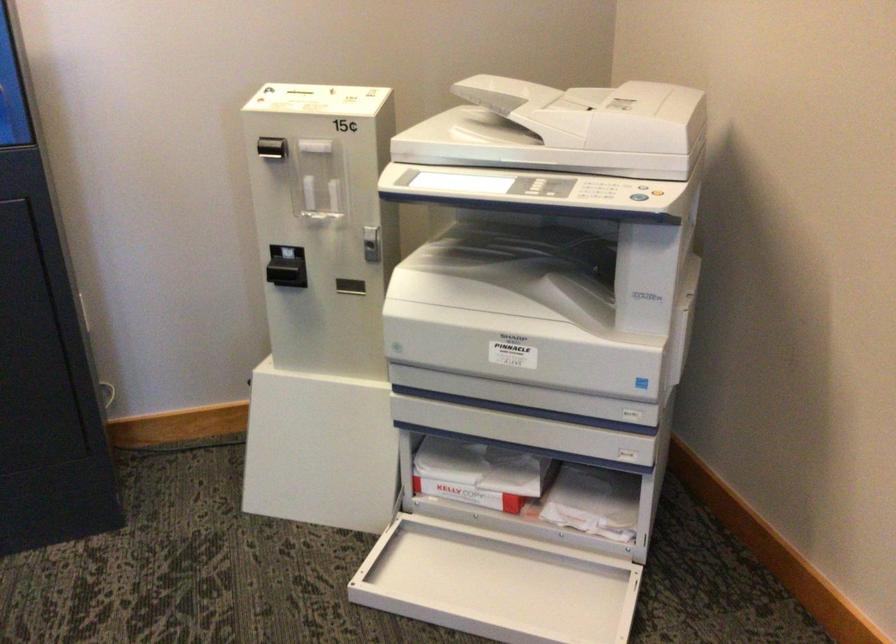
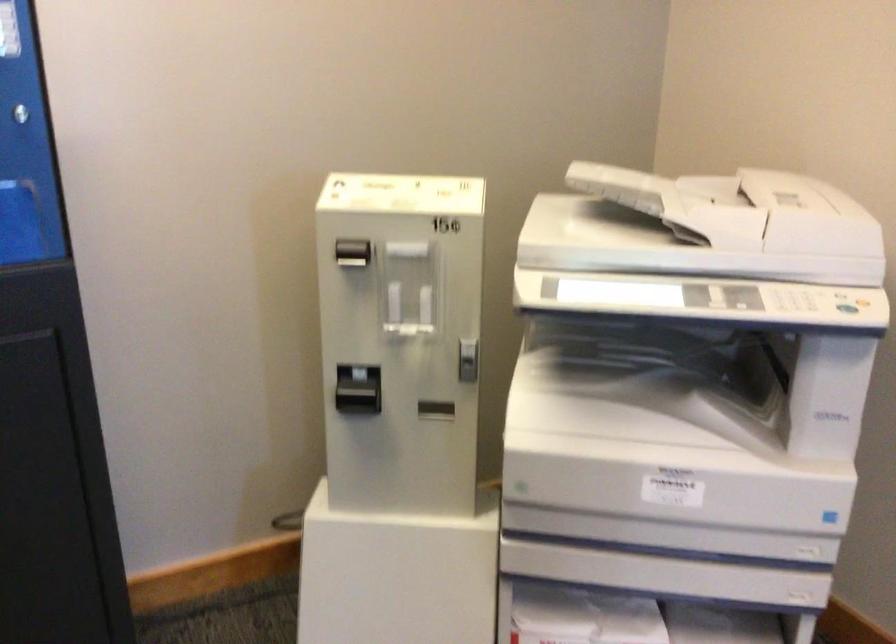
Which direction would the cameraman need to move to produce the second image?

The cameraman walked toward left, forward.